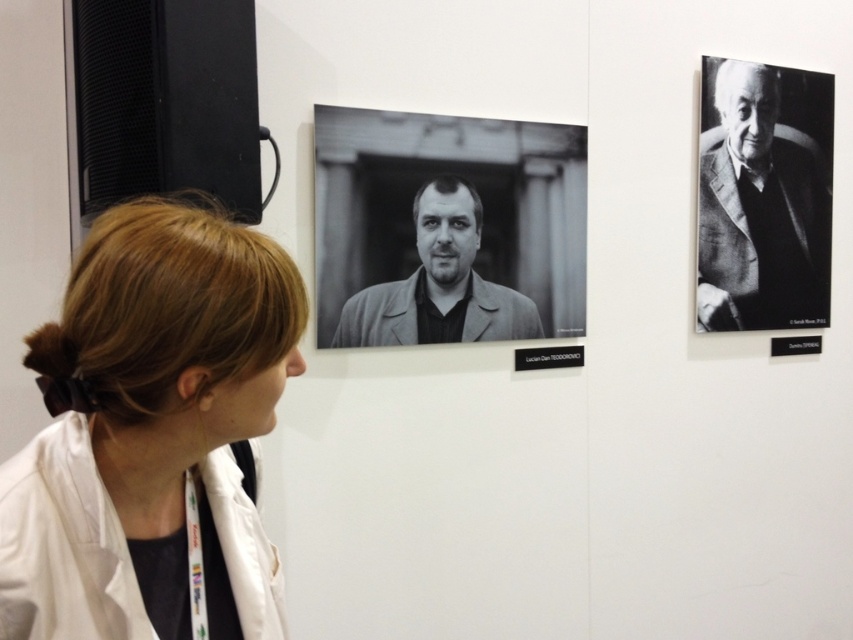
Question: Among these points, which one is farthest from the camera?

Choices:
 (A) (819, 269)
 (B) (369, 337)

Answer: (A)

Question: Which point is farther to the camera?

Choices:
 (A) (415, 243)
 (B) (746, 298)
 (C) (238, 556)

Answer: (B)

Question: Which object is positioned farthest from the black textured suit at upper right?

Choices:
 (A) black matte jacket at center
 (B) blonde hair at center

Answer: (B)

Question: Can you confirm if blonde hair at center is positioned above black matte jacket at center?

Choices:
 (A) yes
 (B) no

Answer: (B)

Question: Can you confirm if blonde hair at center is positioned to the right of black matte jacket at center?

Choices:
 (A) no
 (B) yes

Answer: (A)

Question: Does black textured suit at upper right appear over black matte jacket at center?

Choices:
 (A) no
 (B) yes

Answer: (B)